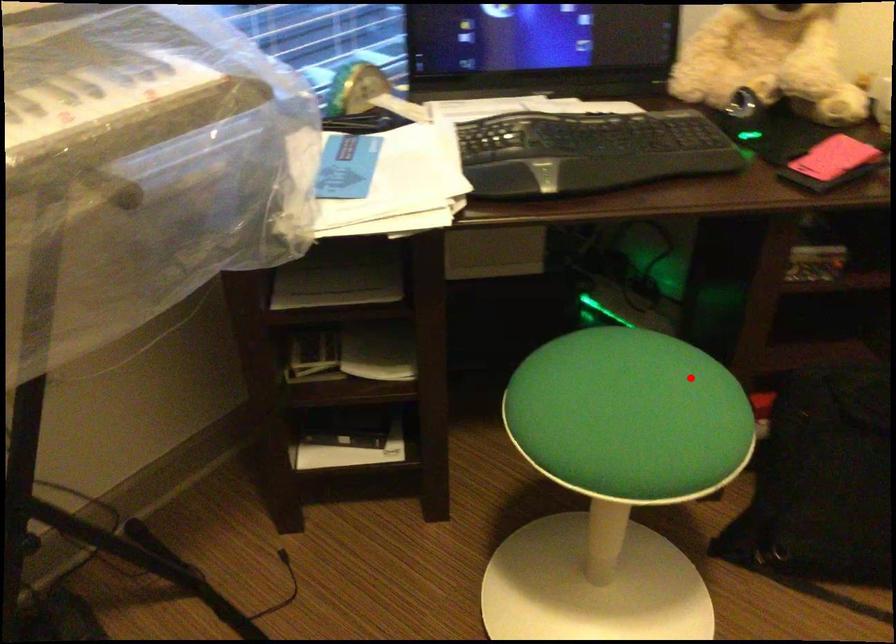
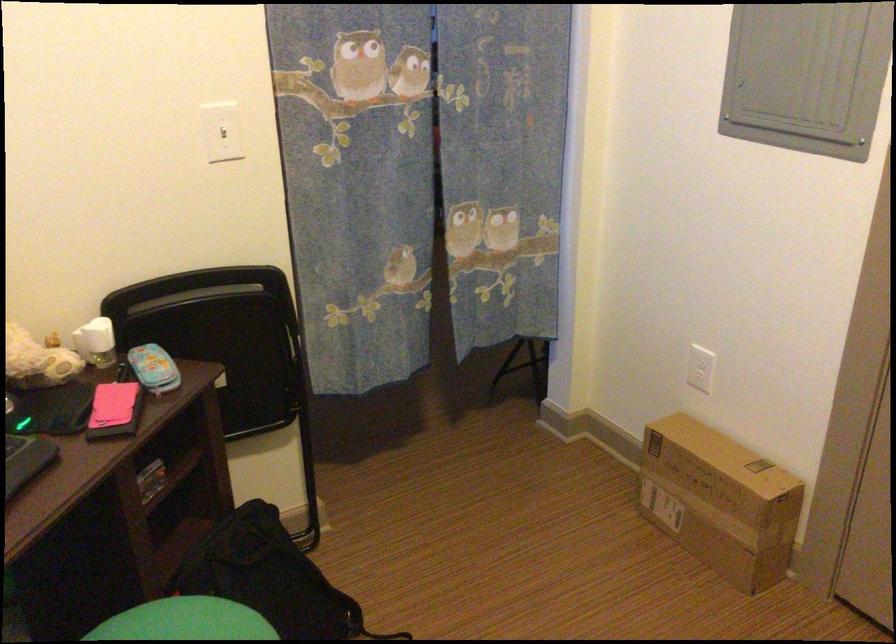
Locate, in the second image, the point that corresponds to the highlighted location in the first image.

(185, 621)